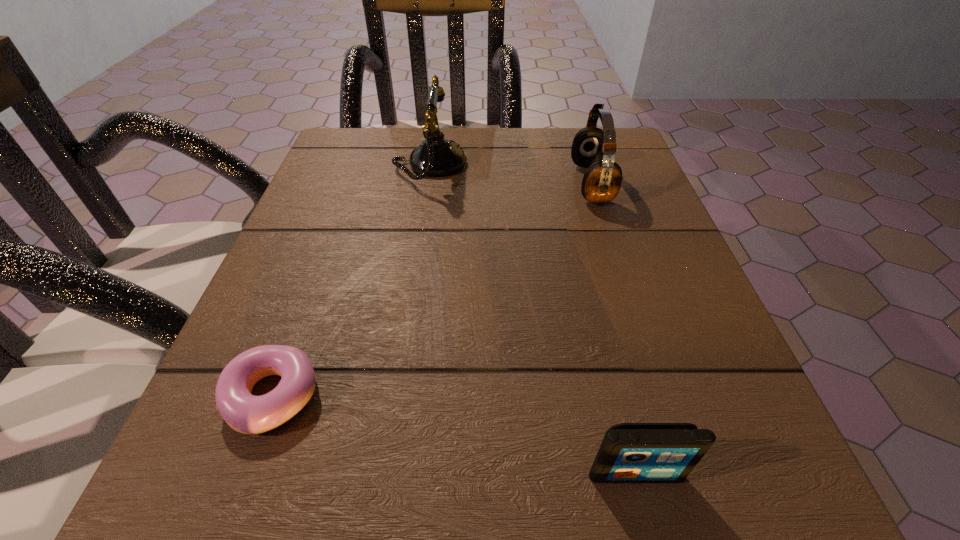
You are a GUI agent. You are given a task and a screenshot of the screen. Output one action in this format:
    pyautogui.click(x=<x>, y=<y>)
    Task: Click on the free space located on the right of the leftmost object
    
    Given the screenshot: What is the action you would take?
    pyautogui.click(x=514, y=396)

Identify the location of telephone that is positioned at the far edge. (436, 156).

This screenshot has height=540, width=960. I want to click on headset located at the far edge, so click(592, 148).

Find the location of `object located at the near edge`. object located at the near edge is located at coordinates (630, 452).

Identify the location of telephone at the left edge. (436, 156).

You are a GUI agent. You are given a task and a screenshot of the screen. Output one action in this format:
    pyautogui.click(x=<x>, y=<y>)
    Task: Click on the doughnut present at the left edge
    This screenshot has width=960, height=540.
    Given the screenshot: What is the action you would take?
    pyautogui.click(x=245, y=413)

Where is `headset that is at the right edge`? This screenshot has height=540, width=960. headset that is at the right edge is located at coordinates (592, 148).

At what (x,y) coordinates should I click in order to perform the action: click on iPod positioned at the right edge. Please return your answer as a coordinate pair (x, y). Image resolution: width=960 pixels, height=540 pixels. Looking at the image, I should click on (630, 452).

Image resolution: width=960 pixels, height=540 pixels. What are the coordinates of `object situated at the far left corner` in the screenshot? It's located at (436, 156).

Locate an element on the screen. The width and height of the screenshot is (960, 540). object that is positioned at the far right corner is located at coordinates pyautogui.click(x=592, y=148).